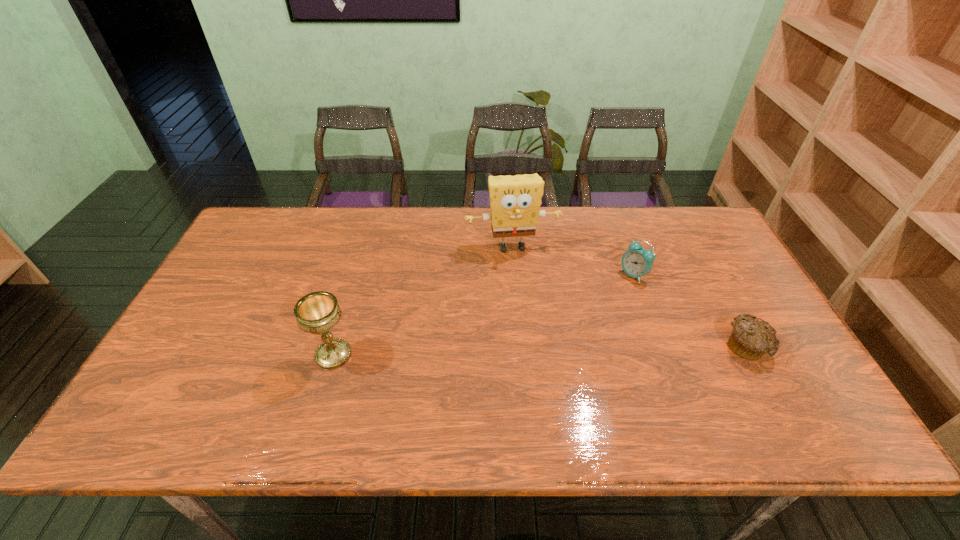
The height and width of the screenshot is (540, 960). Identify the location of vacant spot on the desktop that is between the chalice and the shortest object and is positioned on the face of the tallest object. (537, 351).

Locate an element on the screen. This screenshot has width=960, height=540. free spot on the desktop that is between the chalice and the shortest object and is positioned on the face of the third nearest object is located at coordinates (565, 350).